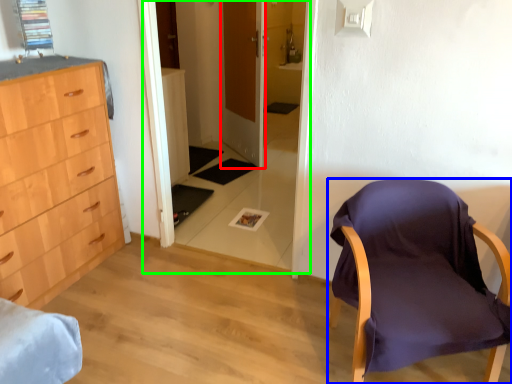
Question: Which object is the farthest from door (highlighted by a red box)? Choose among these: chair (highlighted by a blue box) or glass door (highlighted by a green box).

Choices:
 (A) chair
 (B) glass door

Answer: (A)